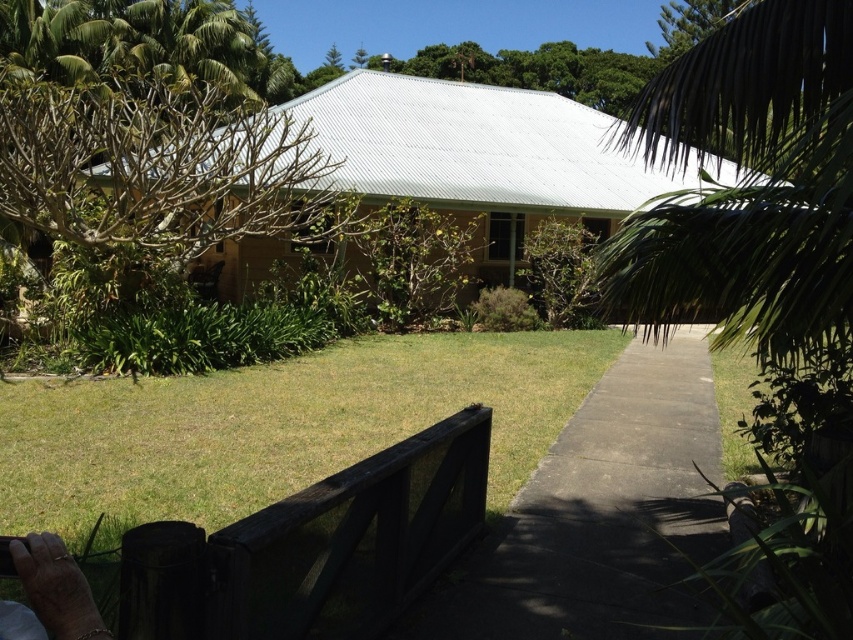
In the scene shown: Does green grass at center appear on the left side of concrete at center?

Indeed, green grass at center is positioned on the left side of concrete at center.

Describe the element at coordinates (277, 426) in the screenshot. I see `green grass at center` at that location.

Which is in front, point (248, 502) or point (662, 545)?

Positioned in front is point (662, 545).

At what (x,y) coordinates should I click in order to perform the action: click on green grass at center. Please return your answer as a coordinate pair (x, y). This screenshot has height=640, width=853. Looking at the image, I should click on (277, 426).